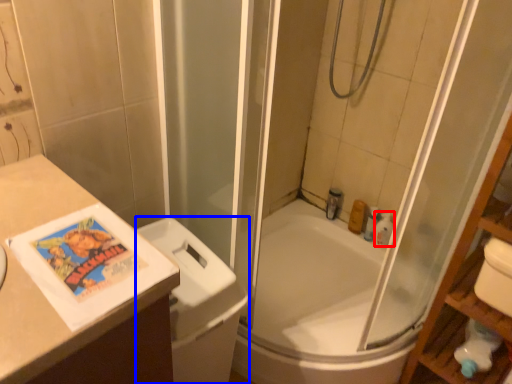
Question: Which object is further to the camera taking this photo, toiletry (highlighted by a red box) or toilet bowl (highlighted by a blue box)?

Choices:
 (A) toiletry
 (B) toilet bowl

Answer: (A)